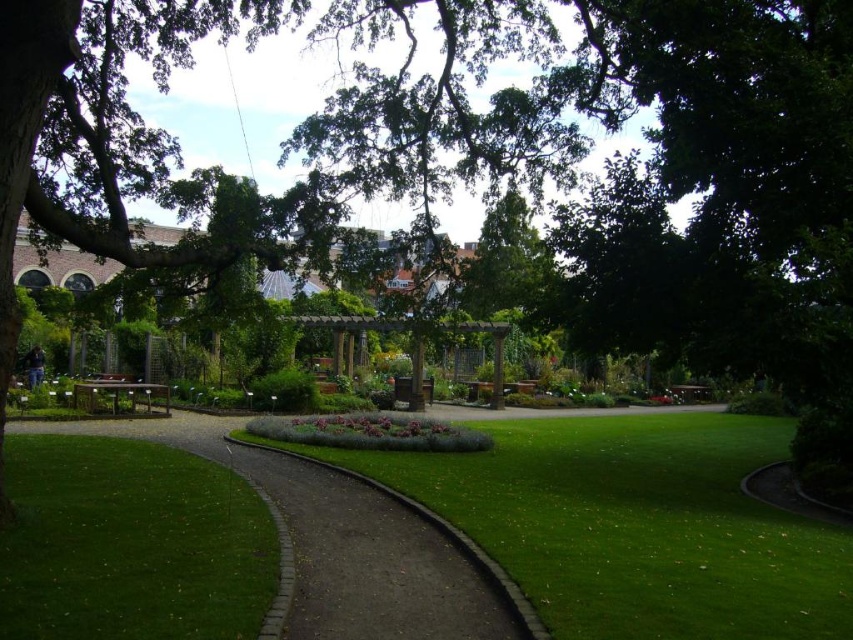
Consider the image. You are a gardener holding a 10 feet long hose. You need to water the green grass at lower left from the brown brick path at center. Can you reach the grass without moving the hose? Please explain.

The distance between the green grass at lower left and the brown brick path at center is 8.33 feet. Since the hose is 10 feet long, it can easily reach the grass without needing to move it.

You are a gardener who needs to mow the lawn. You see the green grass at lower left and the brown brick path at center. Which area requires mowing?

The green grass at lower left requires mowing because it is grass and the brown brick path at center is a brick path, which doesn not need mowing.

You are planning to set up a picnic in this garden. You have a large picnic blanket that covers a significant area. Based on the space available, which area would be more suitable for placing your blanket without overcrowding it? The green grass at lower left or the brown brick path at center?

The brown brick path at center is more suitable because it occupies more space than the green grass at lower left, providing enough area for the picnic blanket.